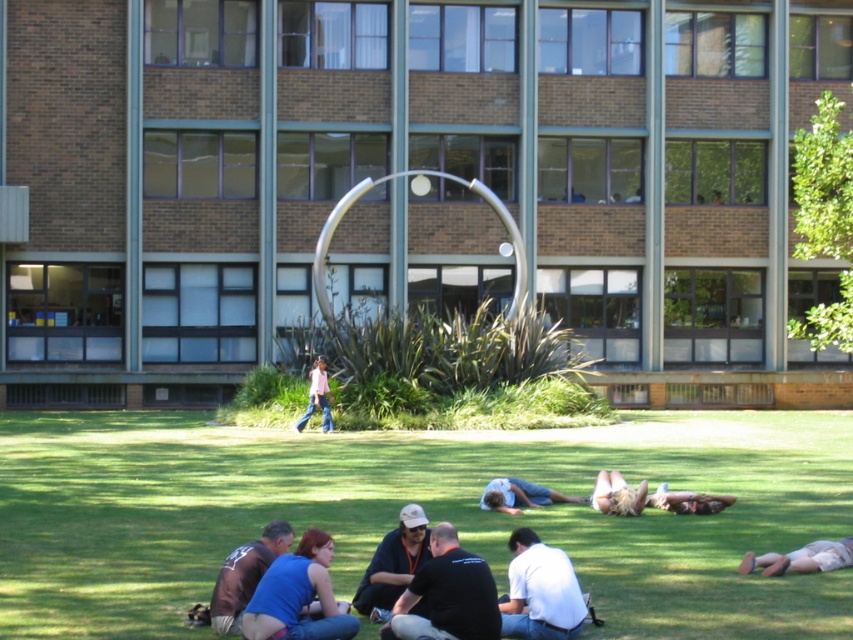
You are a person standing at the edge of the green grass at lower center and want to reach the smooth tan skin at lower right. Considering the height difference between them, which direction should you move to get closer?

The green grass at lower center is taller than the smooth tan skin at lower right, so you should move downward towards the smooth tan skin at lower right to get closer.

You are a photographer trying to capture a photo of the light brown fabric pants at lower right and the light blue denim jeans at lower center. Which of the two should you focus on if you want to include both in your frame without moving your camera? Explain your reasoning based on their positions.

The light blue denim jeans at lower center should be focused on because the light brown fabric pants at lower right is positioned to its right side, meaning they are closer to the edge of the frame. By centering the light blue denim jeans at lower center, both subjects can be included more comfortably within the camera frame.